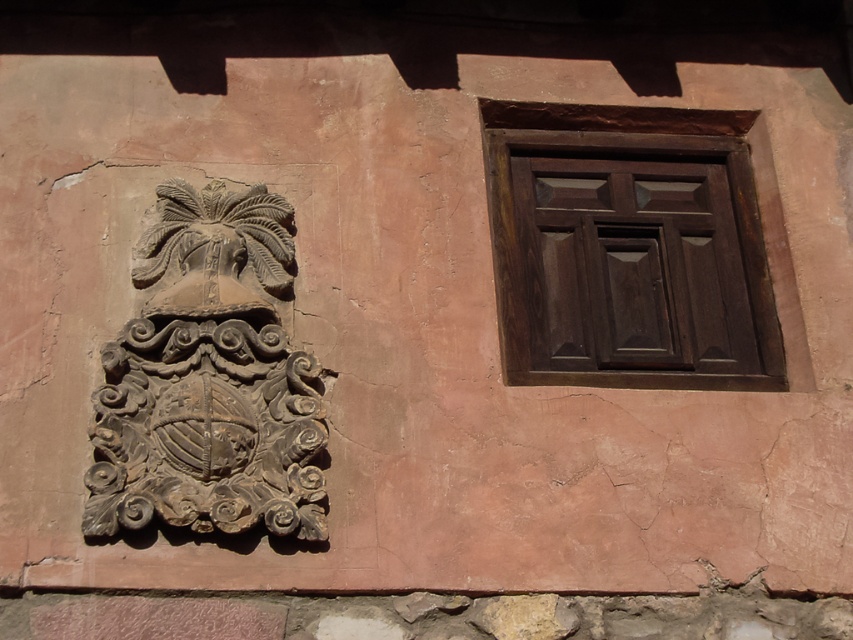
Does dark wood window at upper right appear on the left side of dark brown stone crest at left?

Incorrect, dark wood window at upper right is not on the left side of dark brown stone crest at left.

What do you see at coordinates (628, 248) in the screenshot?
I see `dark wood window at upper right` at bounding box center [628, 248].

Which is in front, point (525, 301) or point (204, 205)?

Point (204, 205) is in front.

I want to click on dark wood window at upper right, so click(x=628, y=248).